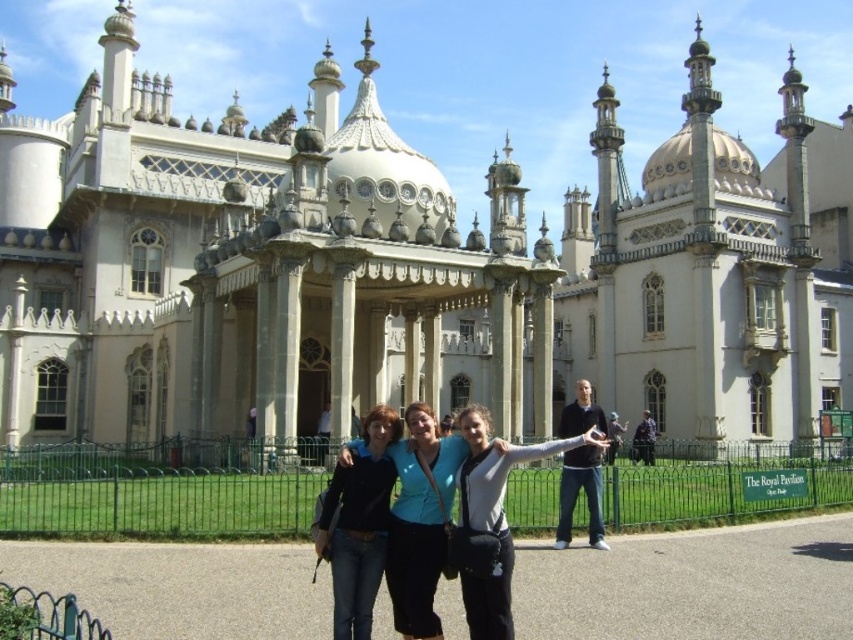
Is matte blue shirt at center in front of matte black jacket at center?

No.

Measure the distance between matte blue shirt at center and matte black jacket at center.

They are 4.68 feet apart.

I want to click on matte blue shirt at center, so [x=421, y=520].

Can you confirm if white stone palace at center is positioned to the left of matte blue shirt at center?

Correct, you'll find white stone palace at center to the left of matte blue shirt at center.

Can you confirm if white stone palace at center is wider than matte blue shirt at center?

Correct, the width of white stone palace at center exceeds that of matte blue shirt at center.

Who is more forward, (331, 396) or (418, 474)?

Point (418, 474) is more forward.

At what (x,y) coordinates should I click in order to perform the action: click on white stone palace at center. Please return your answer as a coordinate pair (x, y). The height and width of the screenshot is (640, 853). Looking at the image, I should click on pyautogui.click(x=408, y=269).

Is white stone palace at center to the right of matte black jacket at center from the viewer's perspective?

Incorrect, white stone palace at center is not on the right side of matte black jacket at center.

Can you confirm if white stone palace at center is smaller than matte black jacket at center?

No.

Is point (259, 176) behind point (367, 490)?

Yes, it is.

Where is `white stone palace at center`? white stone palace at center is located at coordinates (408, 269).